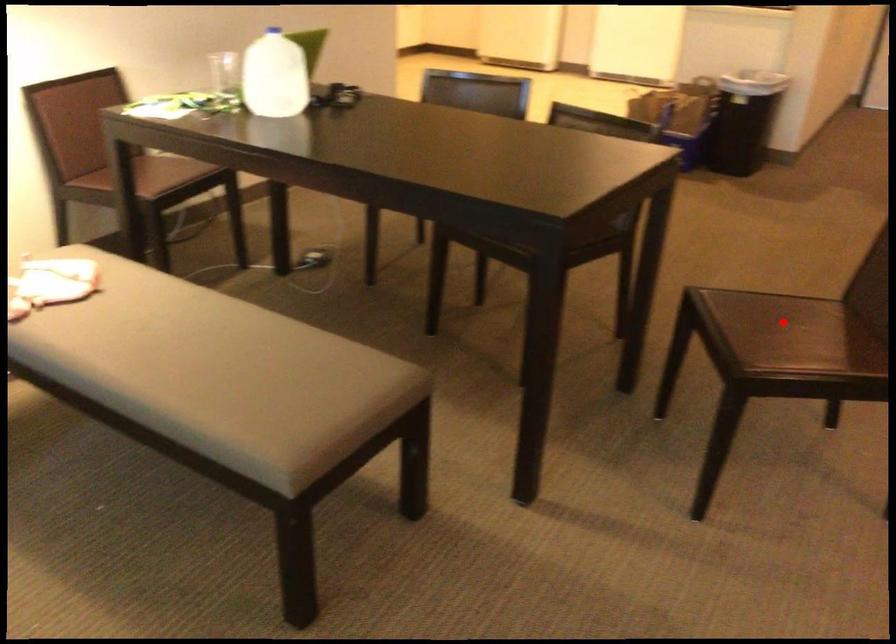
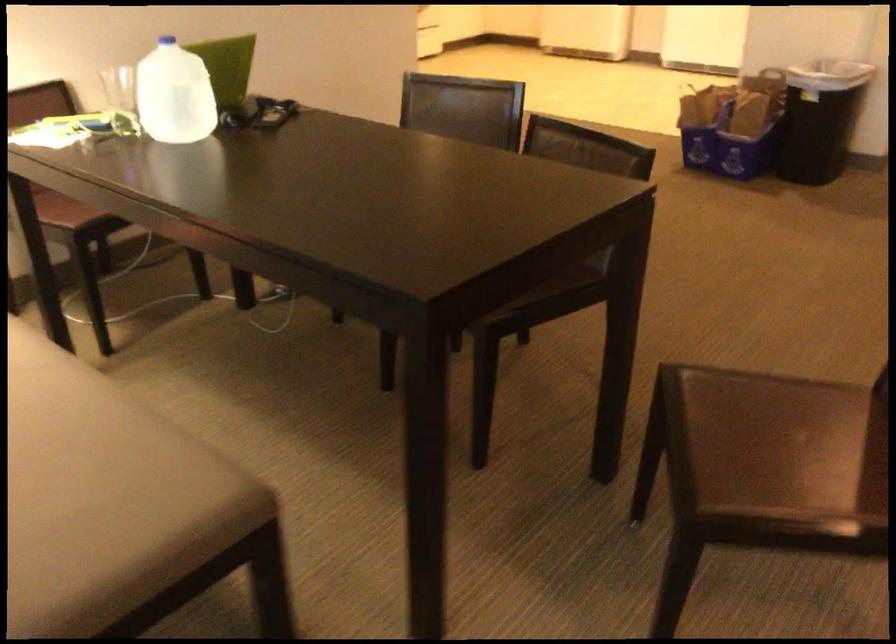
Find the pixel in the second image that matches the highlighted location in the first image.

(782, 430)